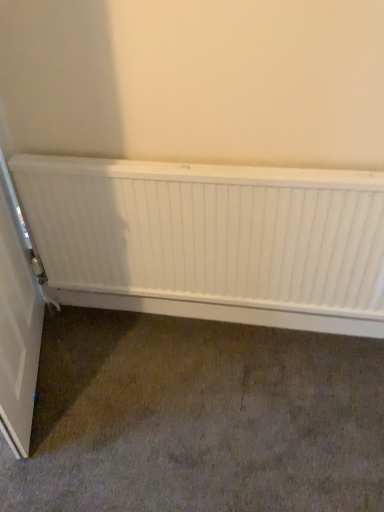
Question: From the image's perspective, is white matte radiator at center above white matte door at left?

Choices:
 (A) no
 (B) yes

Answer: (B)

Question: Does white matte radiator at center have a greater width compared to white matte door at left?

Choices:
 (A) yes
 (B) no

Answer: (B)

Question: From the image's perspective, would you say white matte radiator at center is shown under white matte door at left?

Choices:
 (A) yes
 (B) no

Answer: (B)

Question: Considering the relative sizes of white matte radiator at center and white matte door at left in the image provided, is white matte radiator at center shorter than white matte door at left?

Choices:
 (A) no
 (B) yes

Answer: (B)

Question: From a real-world perspective, is white matte radiator at center physically below white matte door at left?

Choices:
 (A) yes
 (B) no

Answer: (B)

Question: Is white matte radiator at center touching white matte door at left?

Choices:
 (A) no
 (B) yes

Answer: (A)

Question: Is white matte radiator at center a part of white matte door at left?

Choices:
 (A) no
 (B) yes

Answer: (A)

Question: Can you confirm if white matte door at left is wider than white matte radiator at center?

Choices:
 (A) yes
 (B) no

Answer: (A)

Question: Is white matte door at left to the left of white matte radiator at center from the viewer's perspective?

Choices:
 (A) no
 (B) yes

Answer: (B)

Question: Can you confirm if white matte door at left is thinner than white matte radiator at center?

Choices:
 (A) no
 (B) yes

Answer: (A)

Question: Does white matte door at left have a smaller size compared to white matte radiator at center?

Choices:
 (A) yes
 (B) no

Answer: (B)

Question: Is white matte door at left oriented away from white matte radiator at center?

Choices:
 (A) no
 (B) yes

Answer: (B)

Question: From a real-world perspective, is white matte radiator at center positioned above or below white matte door at left?

Choices:
 (A) above
 (B) below

Answer: (A)